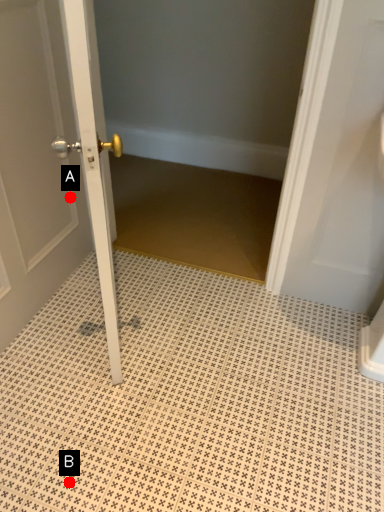
Question: Two points are circled on the image, labeled by A and B beside each circle. Which point is farther from the camera taking this photo?

Choices:
 (A) A is further
 (B) B is further

Answer: (A)